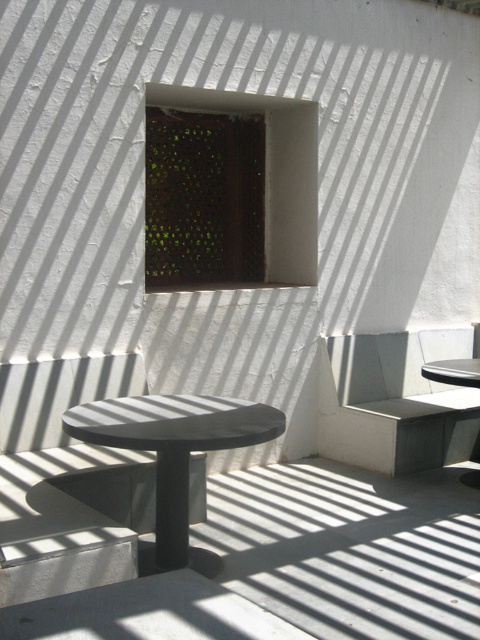
Is concrete bench at right wider than matte gray table at center?

Yes, concrete bench at right is wider than matte gray table at center.

The height and width of the screenshot is (640, 480). Identify the location of concrete bench at right. (395, 401).

The image size is (480, 640). In order to click on concrete bench at right in this screenshot , I will do `click(395, 401)`.

Which of these two, matte gray table at center or smooth gray table at right, stands taller?

With more height is matte gray table at center.

Looking at this image, which is more to the right, matte gray table at center or smooth gray table at right?

smooth gray table at right

Is point (212, 400) in front of point (463, 378)?

Yes, point (212, 400) is closer to viewer.

At what (x,y) coordinates should I click in order to perform the action: click on matte gray table at center. Please return your answer as a coordinate pair (x, y). This screenshot has height=640, width=480. Looking at the image, I should click on [172, 445].

How far apart are matte gray table at center and green mesh screen at upper center?

matte gray table at center is 2.39 meters away from green mesh screen at upper center.

Between matte gray table at center and green mesh screen at upper center, which one is positioned higher?

Positioned higher is green mesh screen at upper center.

Between point (245, 444) and point (300, 140), which one is positioned behind?

The point (300, 140) is more distant.

Identify the location of matte gray table at center. (172, 445).